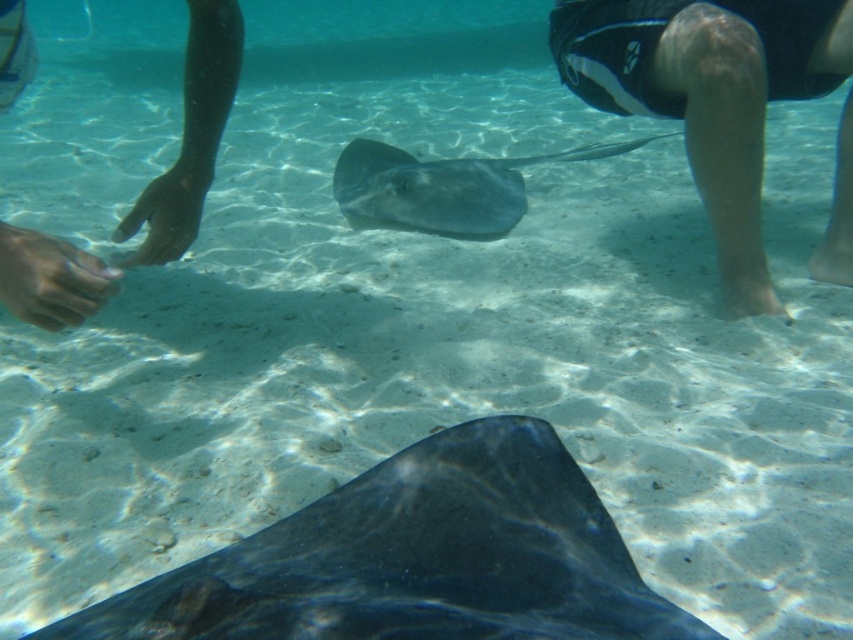
Which of these two, shiny black stingray at bottom or smooth gray stingray at center, stands taller?

smooth gray stingray at center

Is point (308, 506) closer to viewer compared to point (349, 164)?

Yes, point (308, 506) is in front of point (349, 164).

Who is more distant from viewer, (572, 637) or (386, 196)?

Point (386, 196)

This screenshot has height=640, width=853. I want to click on shiny black stingray at bottom, so click(416, 557).

The width and height of the screenshot is (853, 640). What do you see at coordinates (416, 557) in the screenshot?
I see `shiny black stingray at bottom` at bounding box center [416, 557].

Can you confirm if shiny black stingray at bottom is bigger than black rubber leg at upper right?

No, shiny black stingray at bottom is not bigger than black rubber leg at upper right.

Where is `shiny black stingray at bottom`? The image size is (853, 640). shiny black stingray at bottom is located at coordinates (416, 557).

Does black rubber leg at upper right have a greater width compared to dark skin hand at left?

Correct, the width of black rubber leg at upper right exceeds that of dark skin hand at left.

Who is more forward, (846, 67) or (22, 244)?

Positioned in front is point (22, 244).

The height and width of the screenshot is (640, 853). What do you see at coordinates (709, 93) in the screenshot?
I see `black rubber leg at upper right` at bounding box center [709, 93].

Where is `black rubber leg at upper right`? The image size is (853, 640). black rubber leg at upper right is located at coordinates (709, 93).